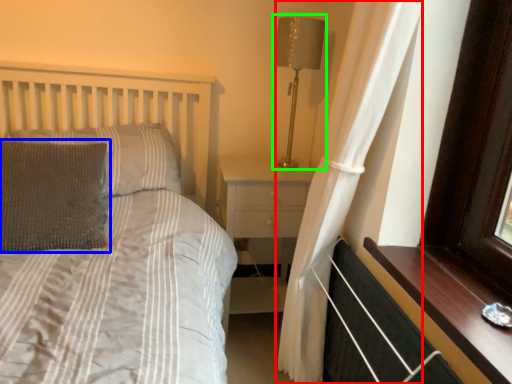
Question: Which is farther away from curtain (highlighted by a red box)? pillow (highlighted by a blue box) or table lamp (highlighted by a green box)?

Choices:
 (A) pillow
 (B) table lamp

Answer: (A)